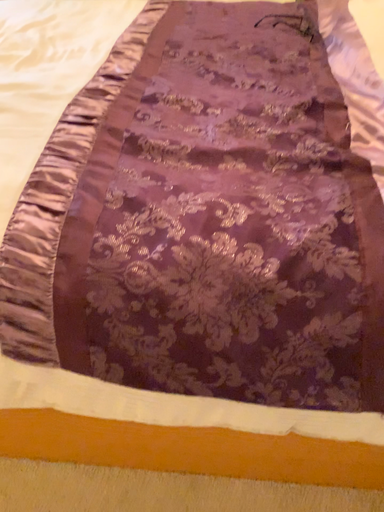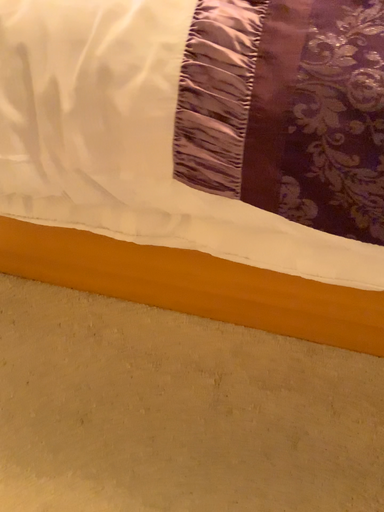
Question: How did the camera likely rotate when shooting the video?

Choices:
 (A) rotated downward
 (B) rotated upward

Answer: (A)